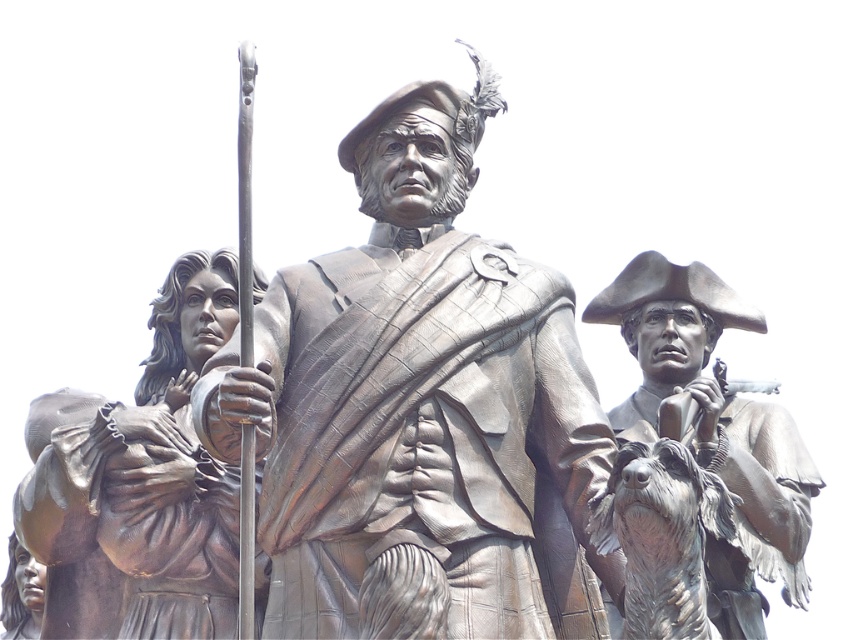
Does bronze statue at center have a greater width compared to bronze statue at left?

Indeed, bronze statue at center has a greater width compared to bronze statue at left.

Is bronze statue at center above bronze statue at left?

Indeed, bronze statue at center is positioned over bronze statue at left.

The width and height of the screenshot is (853, 640). What are the coordinates of `bronze statue at center` in the screenshot? It's located at (416, 404).

Between bronze statue at center and bronze statue at right, which one appears on the left side from the viewer's perspective?

From the viewer's perspective, bronze statue at center appears more on the left side.

Consider the image. Does bronze statue at center appear on the right side of bronze statue at right?

Incorrect, bronze statue at center is not on the right side of bronze statue at right.

Is point (392, 202) behind point (722, 323)?

No, (392, 202) is closer to viewer.

Find the location of a particular element. bronze statue at center is located at coordinates (416, 404).

Between bronze statue at left and bronze statue at right, which one is positioned lower?

bronze statue at right

Locate an element on the screen. This screenshot has height=640, width=853. bronze statue at left is located at coordinates (138, 484).

In order to click on bronze statue at left in this screenshot , I will do `click(138, 484)`.